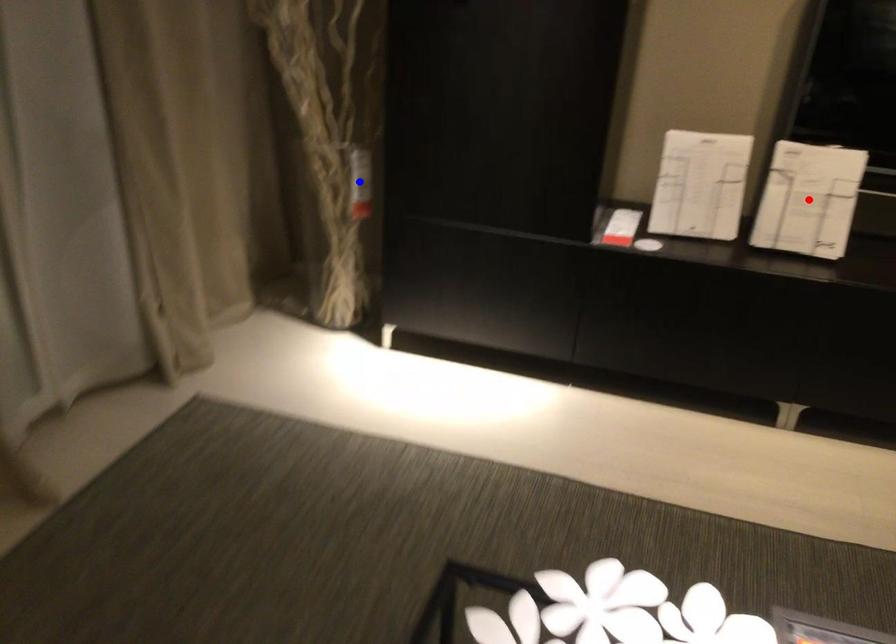
Question: In the image, two points are highlighted. Which point is nearer to the camera? Reply with the corresponding letter.

Choices:
 (A) blue point
 (B) red point

Answer: (B)